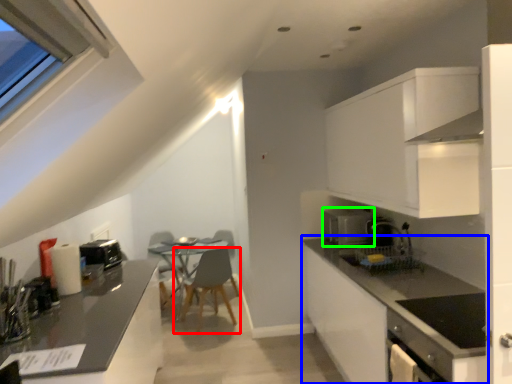
Question: Which is nearer to the chair (highlighted by a red box)? countertop (highlighted by a blue box) or kitchen appliance (highlighted by a green box).

Choices:
 (A) countertop
 (B) kitchen appliance

Answer: (B)